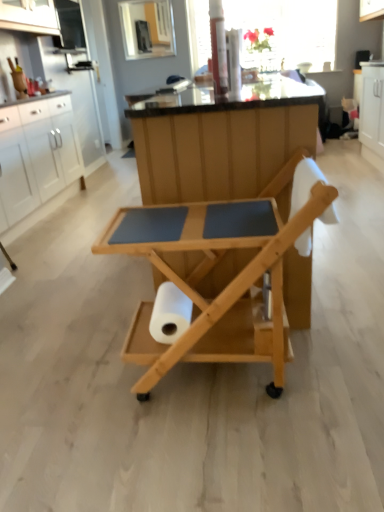
Question: In terms of width, does white matte paper towel at center look wider or thinner when compared to natural wood rolling cart at center?

Choices:
 (A) wide
 (B) thin

Answer: (B)

Question: Relative to natural wood rolling cart at center, is white matte paper towel at center in front or behind?

Choices:
 (A) front
 (B) behind

Answer: (B)

Question: Estimate the real-world distances between objects in this image. Which object is farther from the white matte cabinet at left?

Choices:
 (A) natural wood rolling cart at center
 (B) white matte paper towel at center
 (C) transparent glass window screen at upper center

Answer: (B)

Question: Which object is positioned closest to the white matte paper towel at center?

Choices:
 (A) transparent glass window screen at upper center
 (B) natural wood rolling cart at center
 (C) white matte cabinet at left

Answer: (B)